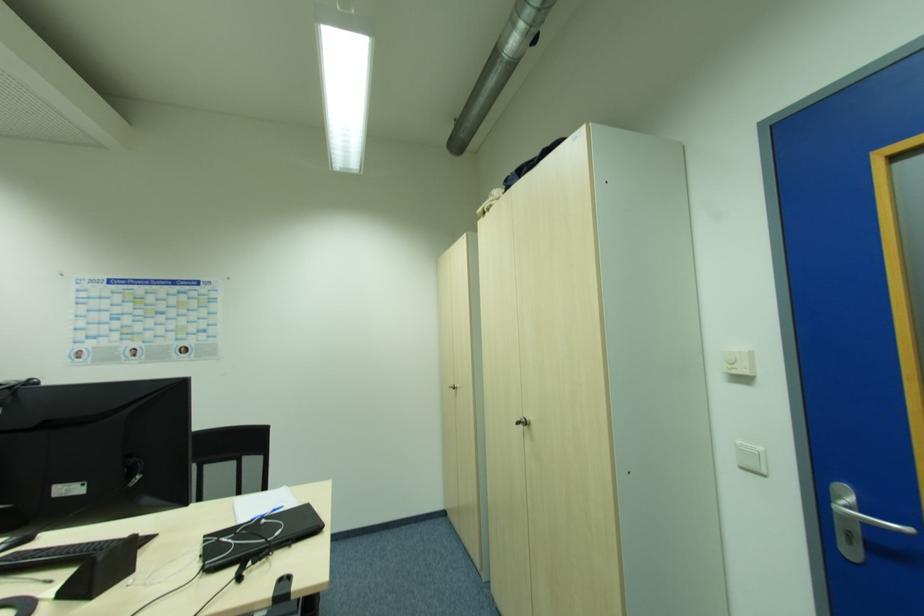
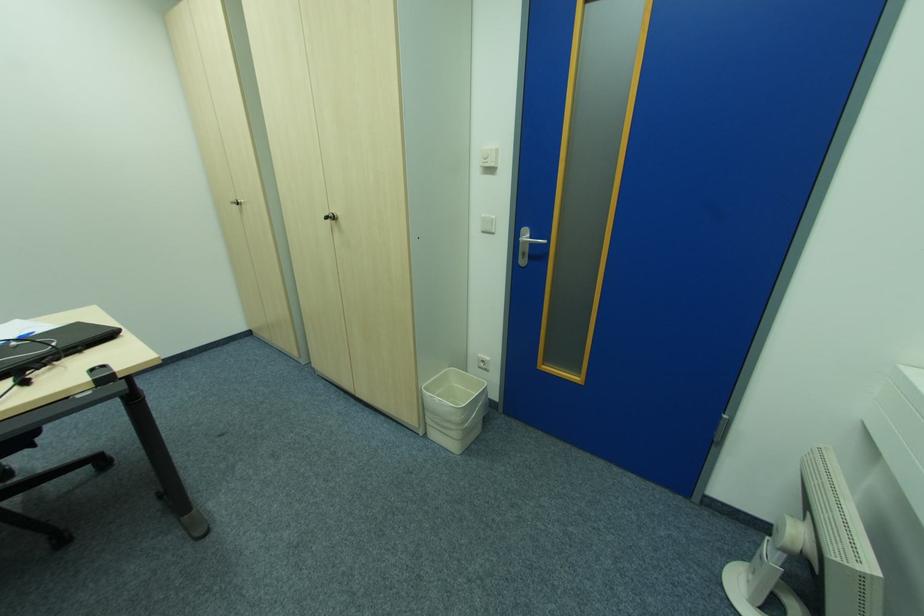
In the second image, find the point that corresponds to the point at 852,537 in the first image.

(526, 256)